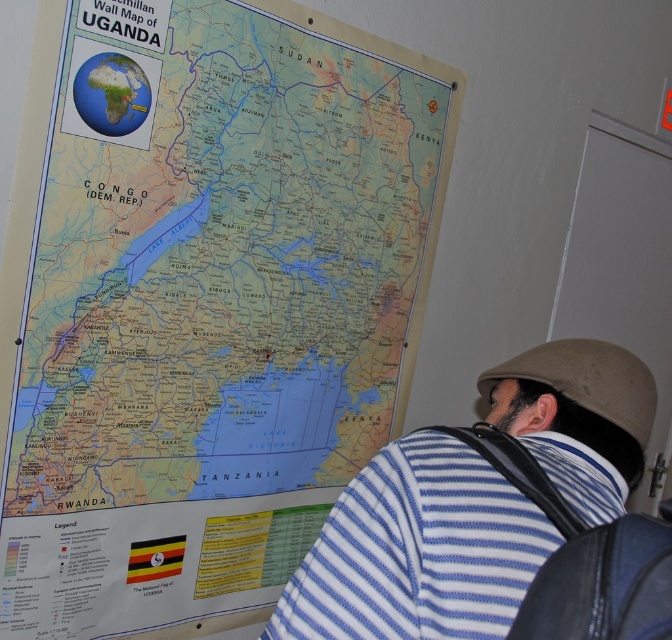
Does matte paper map at upper center appear under blue striped shirt at center?

Actually, matte paper map at upper center is above blue striped shirt at center.

Which is more to the right, matte paper map at upper center or blue striped shirt at center?

blue striped shirt at center is more to the right.

Measure the distance between matte paper map at upper center and camera.

A distance of 91.71 centimeters exists between matte paper map at upper center and camera.

Where is `matte paper map at upper center`? The width and height of the screenshot is (672, 640). matte paper map at upper center is located at coordinates (204, 301).